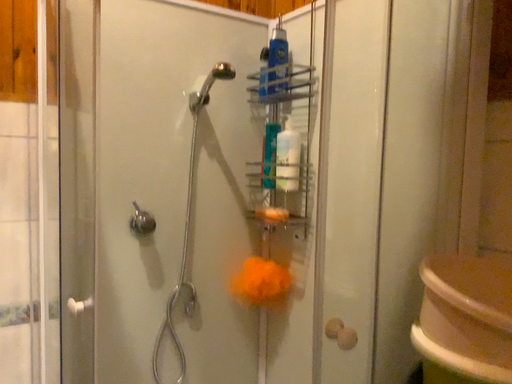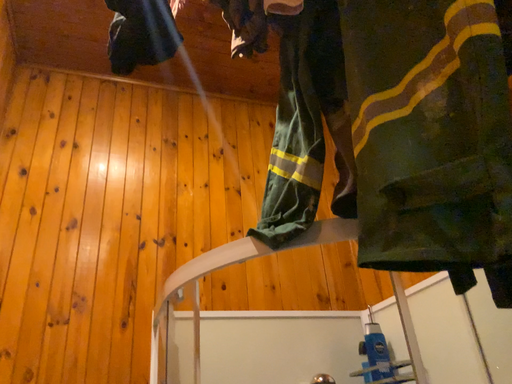
Question: Which way did the camera rotate in the video?

Choices:
 (A) rotated right
 (B) rotated left

Answer: (B)